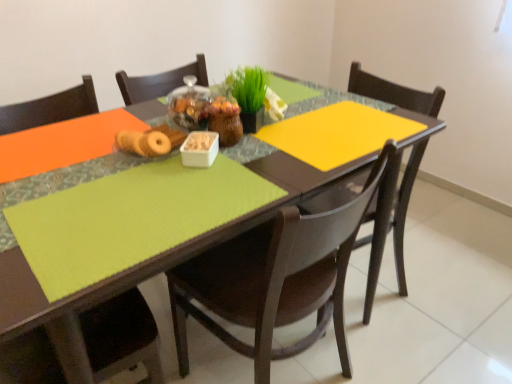
Question: From a real-world perspective, is matte brown donuts at center physically above matte green placemat at lower left, which appears as the third chair when viewed from the right?

Choices:
 (A) no
 (B) yes

Answer: (B)

Question: Is matte brown donuts at center thinner than matte green placemat at lower left, acting as the first chair starting from the left?

Choices:
 (A) yes
 (B) no

Answer: (A)

Question: Is matte brown donuts at center positioned far away from matte green placemat at lower left, which appears as the third chair when viewed from the right?

Choices:
 (A) no
 (B) yes

Answer: (A)

Question: Does matte brown donuts at center lie in front of matte green placemat at lower left, acting as the first chair starting from the left?

Choices:
 (A) no
 (B) yes

Answer: (A)

Question: From a real-world perspective, is matte brown donuts at center beneath matte green placemat at lower left, acting as the first chair starting from the left?

Choices:
 (A) yes
 (B) no

Answer: (B)

Question: Is matte brown donuts at center next to matte green placemat at lower left, which appears as the third chair when viewed from the right, and touching it?

Choices:
 (A) no
 (B) yes

Answer: (A)

Question: Is green matte grass at center positioned with its back to matte brown donuts at center?

Choices:
 (A) no
 (B) yes

Answer: (A)

Question: From the image's perspective, does green matte grass at center appear lower than matte brown donuts at center?

Choices:
 (A) no
 (B) yes

Answer: (A)

Question: From the image's perspective, is green matte grass at center above matte brown donuts at center?

Choices:
 (A) no
 (B) yes

Answer: (B)

Question: Does green matte grass at center have a smaller size compared to matte brown donuts at center?

Choices:
 (A) no
 (B) yes

Answer: (A)

Question: Is the depth of green matte grass at center less than that of matte brown donuts at center?

Choices:
 (A) yes
 (B) no

Answer: (B)

Question: Considering the relative sizes of green matte grass at center and matte brown donuts at center in the image provided, is green matte grass at center wider than matte brown donuts at center?

Choices:
 (A) yes
 (B) no

Answer: (B)

Question: Is white plastic container at center far from green matte grass at center?

Choices:
 (A) yes
 (B) no

Answer: (B)